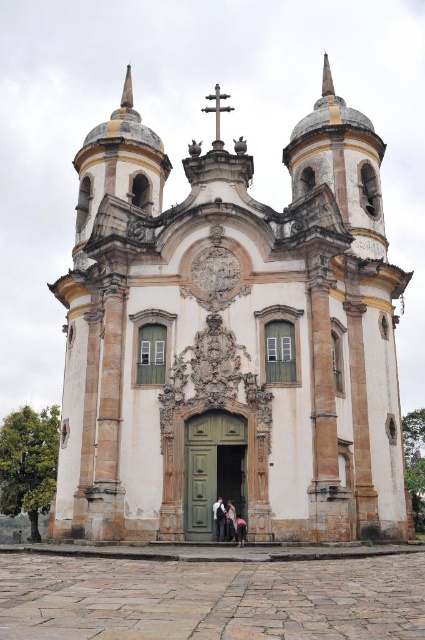
Question: Which point appears closest to the camera in this image?

Choices:
 (A) (223, 518)
 (B) (244, 525)

Answer: (B)

Question: In this image, where is white stone church at center located relative to dark blue fabric at center?

Choices:
 (A) above
 (B) below

Answer: (A)

Question: Considering the real-world distances, which object is farthest from the white stone church at center?

Choices:
 (A) dark blue jeans at lower center
 (B) dark blue fabric at center
 (C) light pink fabric at center

Answer: (A)

Question: Which object is positioned farthest from the white stone church at center?

Choices:
 (A) dark blue fabric at center
 (B) dark blue jeans at lower center
 (C) light pink fabric at center

Answer: (B)

Question: Does dark blue fabric at center appear over light pink fabric at center?

Choices:
 (A) yes
 (B) no

Answer: (A)

Question: Is white stone church at center to the right of light pink fabric at center from the viewer's perspective?

Choices:
 (A) no
 (B) yes

Answer: (B)